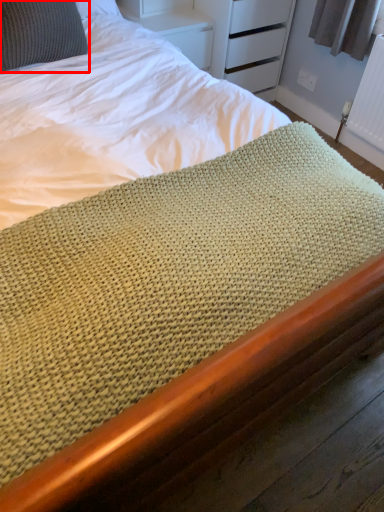
Question: From the image's perspective, considering the relative positions of pillow (annotated by the red box) and radiator in the image provided, where is pillow (annotated by the red box) located with respect to the staircase?

Choices:
 (A) above
 (B) below

Answer: (A)